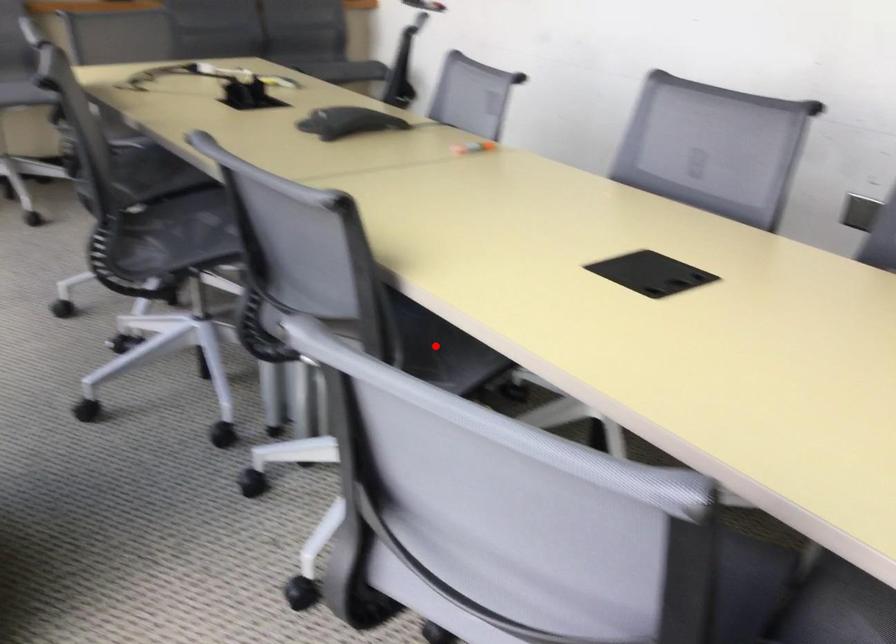
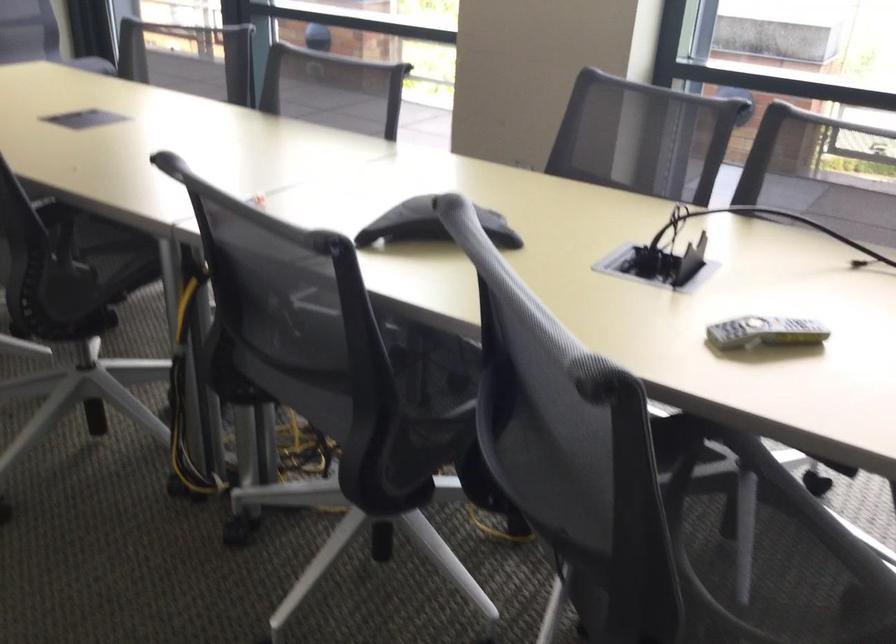
Question: I am providing you with two images of the same scene from different viewpoints. A red point is marked on the first image. Can you still see the location of the red point in image 2?

Choices:
 (A) Yes
 (B) No

Answer: (B)